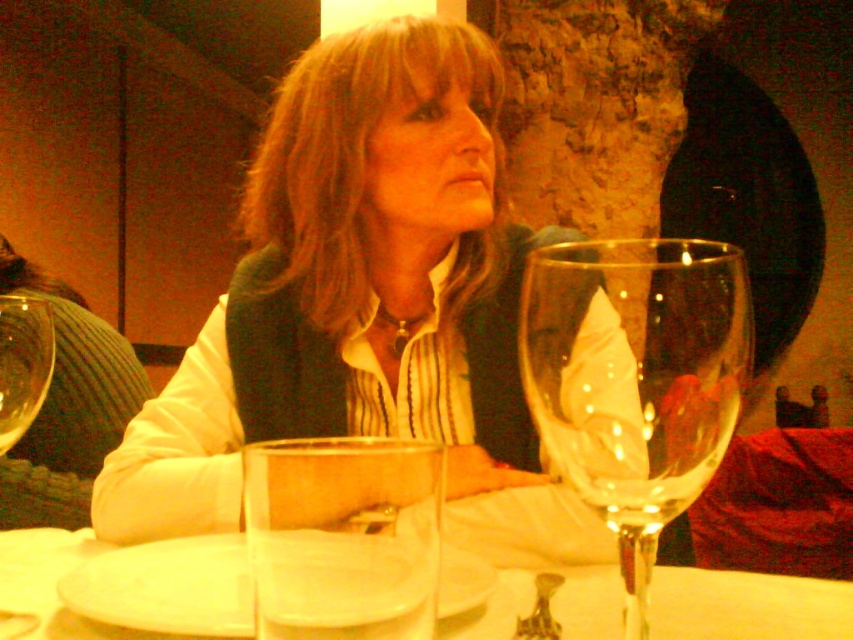
Does matte black vest at center have a lesser height compared to transparent glass wine glass at center?

In fact, matte black vest at center may be taller than transparent glass wine glass at center.

Does point (442, 387) come closer to viewer compared to point (519, 340)?

No, (442, 387) is behind (519, 340).

The height and width of the screenshot is (640, 853). Identify the location of matte black vest at center. (364, 305).

Who is taller, transparent glass wine glass at center or transparent glass at left?

transparent glass wine glass at center

Who is lower down, transparent glass wine glass at center or transparent glass at left?

transparent glass wine glass at center is lower down.

Which is behind, point (572, 432) or point (9, 444)?

The point (9, 444) is more distant.

Where is `transparent glass wine glass at center`? This screenshot has width=853, height=640. transparent glass wine glass at center is located at coordinates (637, 380).

Is transparent glass wine glass at center wider than clear glass cup at center?

Indeed, transparent glass wine glass at center has a greater width compared to clear glass cup at center.

Who is more distant from viewer, (693, 365) or (364, 468)?

Positioned behind is point (693, 365).

You are a GUI agent. You are given a task and a screenshot of the screen. Output one action in this format:
    pyautogui.click(x=<x>, y=<y>)
    Task: Click on the transparent glass wine glass at center
    The width and height of the screenshot is (853, 640).
    Given the screenshot: What is the action you would take?
    pyautogui.click(x=637, y=380)